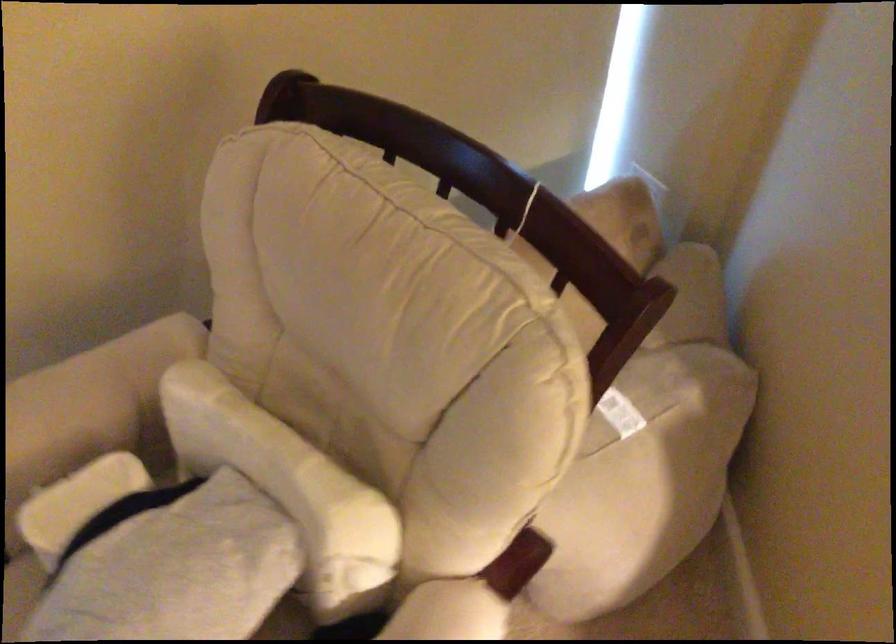
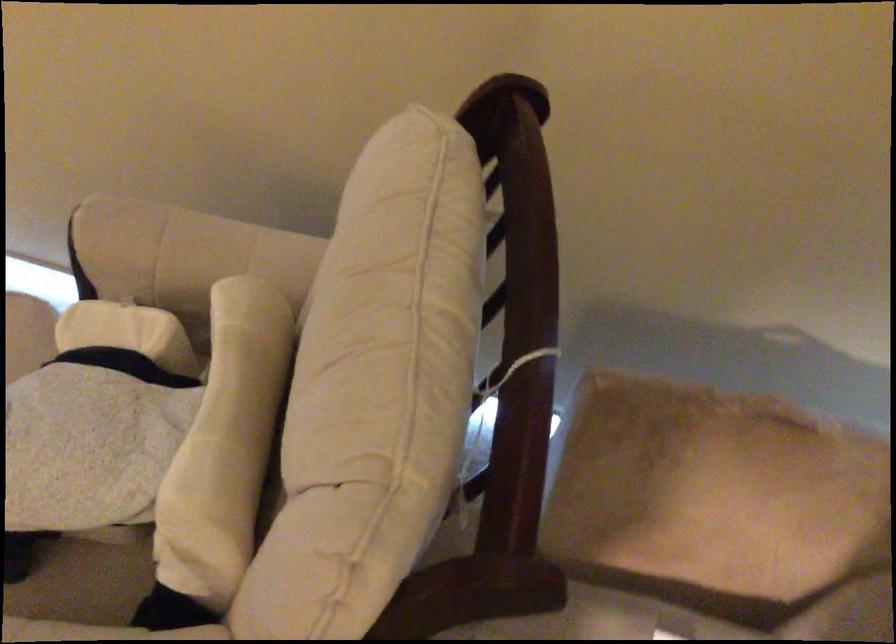
Where in the second image is the point corresponding to (x=72, y=402) from the first image?

(181, 250)